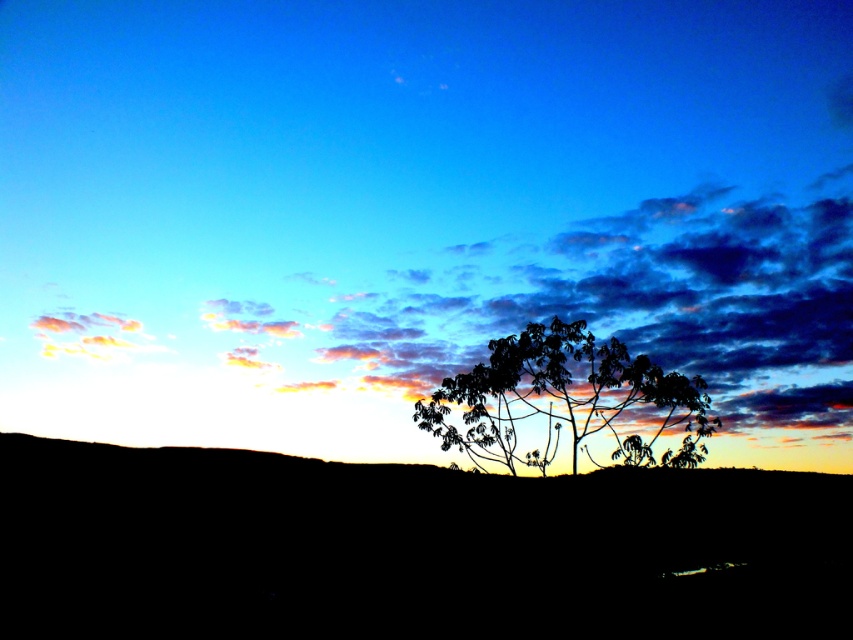
Between cloudy sky at upper center and silhouette leafy tree at center, which one is positioned lower?

silhouette leafy tree at center is below.

Is point (498, 316) in front of point (479, 428)?

No, it is not.

Find the location of a particular element. cloudy sky at upper center is located at coordinates (496, 332).